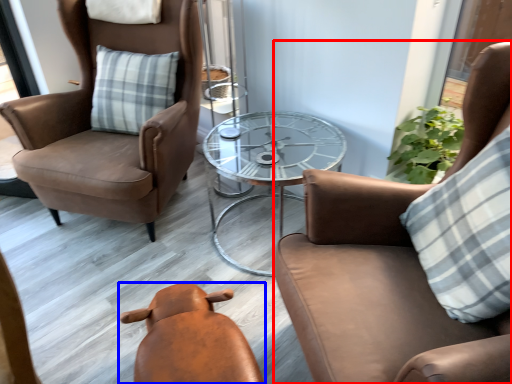
Question: Which object appears closest to the camera in this image, chair (highlighted by a red box) or chair (highlighted by a blue box)?

Choices:
 (A) chair
 (B) chair

Answer: (A)